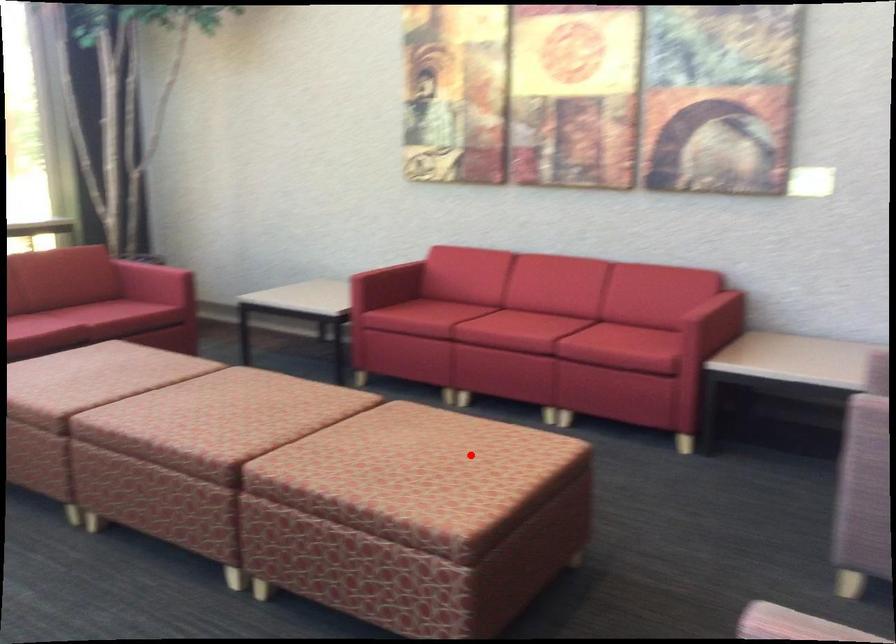
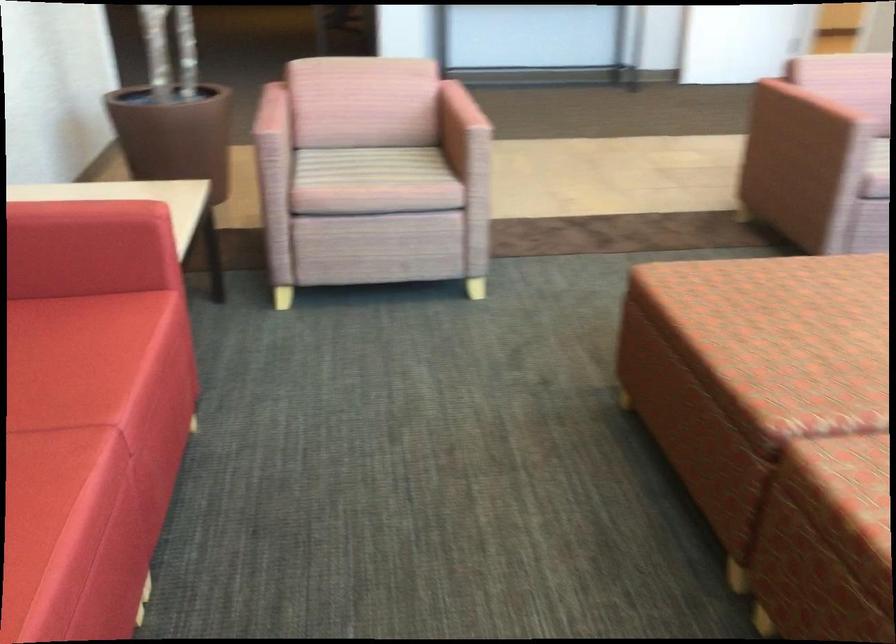
Question: A red point is marked in image1. In image2, is the corresponding 3D point closer to the camera or farther? Reply with the corresponding letter.

Choices:
 (A) The corresponding 3D point is closer.
 (B) The corresponding 3D point is farther.

Answer: (A)